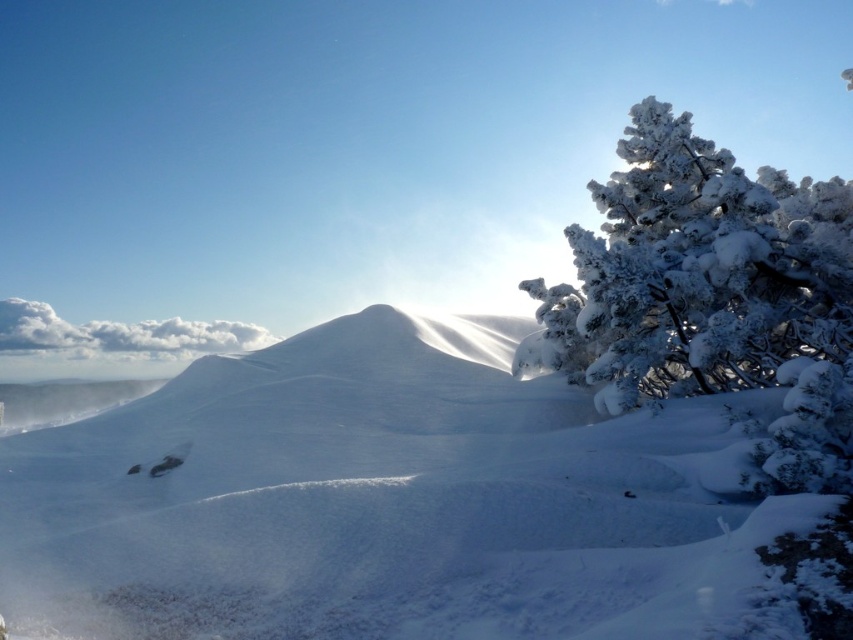
Question: Can you confirm if white frosty tree at right is positioned to the right of white fluffy cloud at upper left?

Choices:
 (A) no
 (B) yes

Answer: (B)

Question: Is white frosty tree at right behind white fluffy cloud at upper left?

Choices:
 (A) yes
 (B) no

Answer: (B)

Question: Which of the following is the farthest from the observer?

Choices:
 (A) white frosty tree at right
 (B) white fluffy cloud at upper left

Answer: (B)

Question: Among these points, which one is farthest from the camera?

Choices:
 (A) (689, 129)
 (B) (158, 358)

Answer: (B)

Question: In this image, where is white frosty tree at right located relative to white fluffy cloud at upper left?

Choices:
 (A) below
 (B) above

Answer: (B)

Question: Which object appears closest to the camera in this image?

Choices:
 (A) white fluffy cloud at upper left
 (B) white frosty tree at right

Answer: (B)